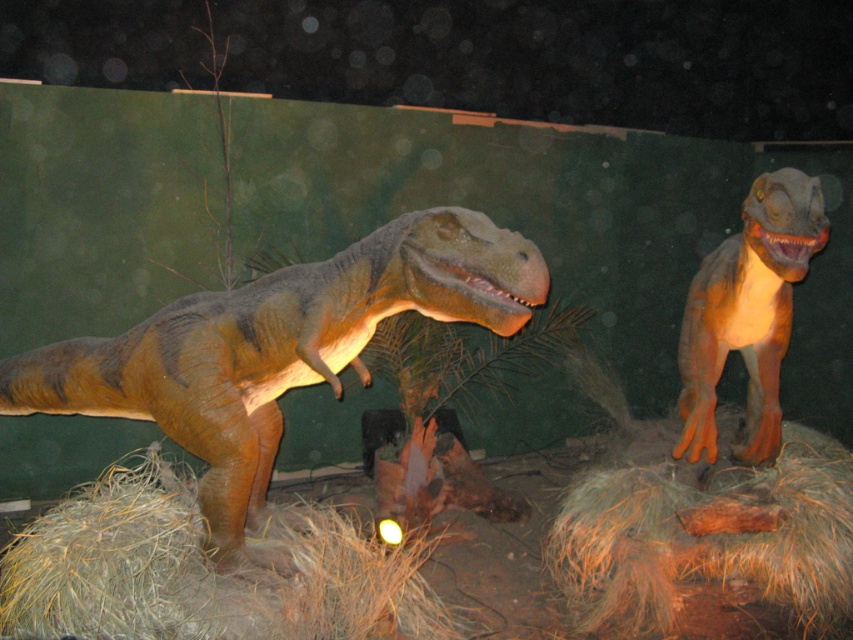
You are a visitor at a museum exhibit and see the brown fibrous hay at right and the orange matte dinosaur at right. Which object is positioned lower in the scene?

The brown fibrous hay at right is positioned below the orange matte dinosaur at right, so it is lower in the scene.

You are standing in front of a display featuring a brown straw at lower left and an orange matte dinosaur at right. Which object is positioned to the east of the other?

The orange matte dinosaur at right is positioned to the east of the brown straw at lower left because the brown straw at lower left is to the left of orange matte dinosaur at right.